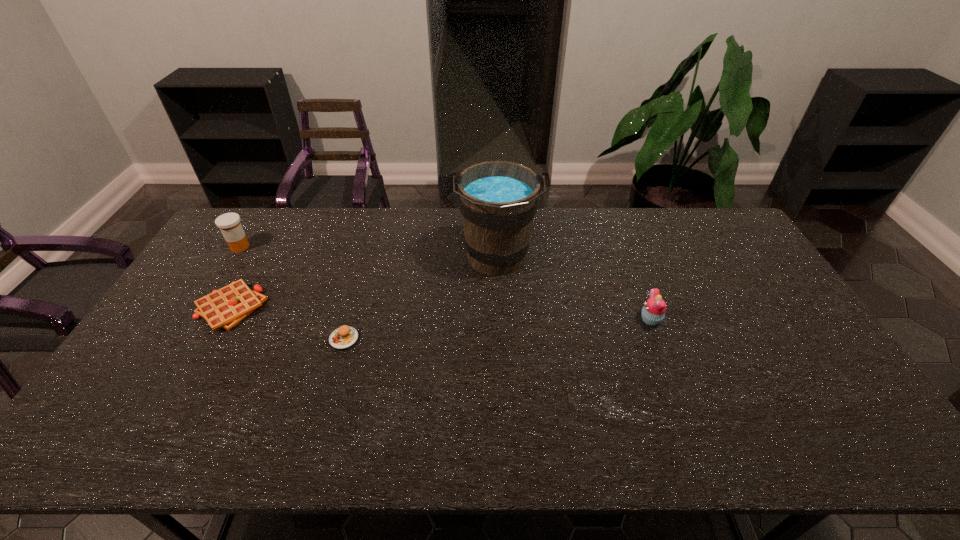
At what (x,y) coordinates should I click in order to perform the action: click on vacant space located 0.120m on the face of the third tallest object. Please return your answer as a coordinate pair (x, y). Looking at the image, I should click on (598, 320).

The height and width of the screenshot is (540, 960). In order to click on free space located 0.290m on the face of the third tallest object in this screenshot , I will do `click(540, 320)`.

You are a GUI agent. You are given a task and a screenshot of the screen. Output one action in this format:
    pyautogui.click(x=<x>, y=<y>)
    Task: Click on the free spot located on the right of the waffle
    Image resolution: width=960 pixels, height=540 pixels.
    Given the screenshot: What is the action you would take?
    pyautogui.click(x=319, y=308)

Identify the location of blank area located on the back of the patty. (370, 249).

Locate an element on the screen. wine bucket positioned at the far edge is located at coordinates click(497, 199).

Where is `medicine located in the far edge section of the desktop`? medicine located in the far edge section of the desktop is located at coordinates (229, 223).

Image resolution: width=960 pixels, height=540 pixels. Find the location of `medicine at the left edge`. medicine at the left edge is located at coordinates (229, 223).

Image resolution: width=960 pixels, height=540 pixels. Identify the location of waffle located in the left edge section of the desktop. (227, 307).

Identify the location of object present at the far left corner. This screenshot has height=540, width=960. (229, 223).

In the image, there is a desktop. What are the coordinates of `free space at the far edge` in the screenshot? It's located at (373, 225).